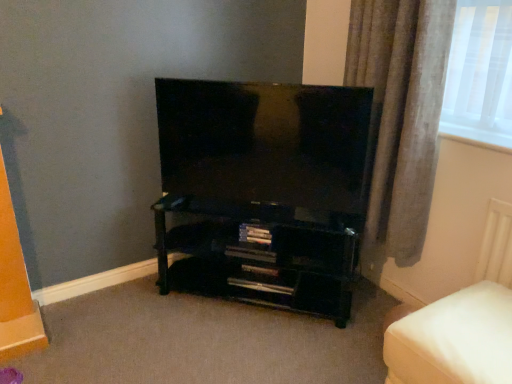
At what (x,y) coordinates should I click in order to perform the action: click on white fabric ottoman at lower right. Please return your answer as a coordinate pair (x, y). Looking at the image, I should click on (454, 339).

Find the location of a particular element. The height and width of the screenshot is (384, 512). black glossy tv at center is located at coordinates (266, 144).

The height and width of the screenshot is (384, 512). In order to click on white fabric ottoman at lower right in this screenshot , I will do pyautogui.click(x=454, y=339).

Is gray fabric curtain at right not inside white fabric ottoman at lower right?

Yes, gray fabric curtain at right is located beyond the bounds of white fabric ottoman at lower right.

Does gray fabric curtain at right have a lesser height compared to white fabric ottoman at lower right?

In fact, gray fabric curtain at right may be taller than white fabric ottoman at lower right.

Consider the image. Does gray fabric curtain at right turn towards white fabric ottoman at lower right?

No, gray fabric curtain at right is not turned towards white fabric ottoman at lower right.

How many degrees apart are the facing directions of black glossy tv at center and white fabric ottoman at lower right?

black glossy tv at center and white fabric ottoman at lower right are facing 42.9 degrees away from each other.

From the image's perspective, who appears lower, black glossy tv at center or white fabric ottoman at lower right?

white fabric ottoman at lower right is shown below in the image.

Is black glossy tv at center turned away from white fabric ottoman at lower right?

No.

In the scene shown: Looking at their sizes, would you say black glossy tv at center is wider or thinner than gray fabric curtain at right?

black glossy tv at center is thinner than gray fabric curtain at right.

In the scene shown: From the image's perspective, between black glossy tv at center and gray fabric curtain at right, which one is located above?

gray fabric curtain at right, from the image's perspective.

The width and height of the screenshot is (512, 384). I want to click on curtain located on the right of black glossy tv at center, so click(401, 112).

From a real-world perspective, is black glossy tv at center above or below gray fabric curtain at right?

Clearly, from a real-world perspective, black glossy tv at center is below gray fabric curtain at right.

In the image, is black glossy shelf at lower center positioned in front of or behind gray fabric curtain at right?

black glossy shelf at lower center is positioned farther from the viewer than gray fabric curtain at right.

Based on the photo, in terms of height, does black glossy shelf at lower center look taller or shorter compared to gray fabric curtain at right?

black glossy shelf at lower center is shorter than gray fabric curtain at right.

From the image's perspective, relative to gray fabric curtain at right, is black glossy shelf at lower center above or below?

Based on their image positions, black glossy shelf at lower center is located beneath gray fabric curtain at right.

Looking at this image, how distant is black glossy shelf at lower center from gray fabric curtain at right?

They are 22.58 inches apart.

Can you confirm if black glossy shelf at lower center is taller than black glossy tv at center?

In fact, black glossy shelf at lower center may be shorter than black glossy tv at center.

Is black glossy shelf at lower center completely or partially outside of black glossy tv at center?

Yes, black glossy shelf at lower center is not within black glossy tv at center.

Is black glossy shelf at lower center smaller than black glossy tv at center?

Actually, black glossy shelf at lower center might be larger than black glossy tv at center.

Is black glossy shelf at lower center oriented towards black glossy tv at center?

No.

From a real-world perspective, which is physically above, white fabric ottoman at lower right or black glossy shelf at lower center?

In real-world perspective, black glossy shelf at lower center is above.

Can you tell me how much white fabric ottoman at lower right and black glossy shelf at lower center differ in facing direction?

43 degrees separate the facing orientations of white fabric ottoman at lower right and black glossy shelf at lower center.

Between white fabric ottoman at lower right and black glossy shelf at lower center, which one has smaller size?

white fabric ottoman at lower right is smaller.

Is white fabric ottoman at lower right taller than black glossy shelf at lower center?

No, white fabric ottoman at lower right is not taller than black glossy shelf at lower center.

Is the surface of gray fabric curtain at right in direct contact with black glossy shelf at lower center?

No, gray fabric curtain at right is not making contact with black glossy shelf at lower center.

From a real-world perspective, is gray fabric curtain at right physically located above or below black glossy shelf at lower center?

From a real-world perspective, gray fabric curtain at right is physically above black glossy shelf at lower center.

Which of these two, gray fabric curtain at right or black glossy shelf at lower center, stands shorter?

Standing shorter between the two is black glossy shelf at lower center.

From the image's perspective, is gray fabric curtain at right above black glossy shelf at lower center?

Correct, gray fabric curtain at right appears higher than black glossy shelf at lower center in the image.

Where is `curtain above the white fabric ottoman at lower right (from a real-world perspective)`? This screenshot has height=384, width=512. curtain above the white fabric ottoman at lower right (from a real-world perspective) is located at coordinates (401, 112).

The width and height of the screenshot is (512, 384). Identify the location of television that appears behind the white fabric ottoman at lower right. (266, 144).

Based on their spatial positions, is white fabric ottoman at lower right or black glossy tv at center closer to black glossy shelf at lower center?

black glossy tv at center lies closer to black glossy shelf at lower center than the other object.

Based on their spatial positions, is white fabric ottoman at lower right or black glossy tv at center further from gray fabric curtain at right?

white fabric ottoman at lower right.

Consider the image. Looking at the image, which one is located closer to white fabric ottoman at lower right, gray fabric curtain at right or black glossy tv at center?

gray fabric curtain at right is closer to white fabric ottoman at lower right.

Looking at the image, which one is located closer to black glossy tv at center, white fabric ottoman at lower right or black glossy shelf at lower center?

Among the two, black glossy shelf at lower center is located nearer to black glossy tv at center.

Looking at the image, which one is located further to gray fabric curtain at right, black glossy shelf at lower center or white fabric ottoman at lower right?

white fabric ottoman at lower right is positioned further to the anchor gray fabric curtain at right.

Based on the photo, from the image, which object appears to be nearer to black glossy shelf at lower center, black glossy tv at center or gray fabric curtain at right?

black glossy tv at center.

Based on their spatial positions, is black glossy tv at center or gray fabric curtain at right further from white fabric ottoman at lower right?

Based on the image, black glossy tv at center appears to be further to white fabric ottoman at lower right.

When comparing their distances from black glossy tv at center, does gray fabric curtain at right or white fabric ottoman at lower right seem closer?

gray fabric curtain at right lies closer to black glossy tv at center than the other object.

This screenshot has width=512, height=384. I want to click on television between gray fabric curtain at right and white fabric ottoman at lower right vertically, so click(266, 144).

This screenshot has width=512, height=384. I want to click on television between black glossy shelf at lower center and white fabric ottoman at lower right, so [266, 144].

This screenshot has width=512, height=384. What are the coordinates of `shelf between gray fabric curtain at right and white fabric ottoman at lower right from top to bottom` in the screenshot? It's located at (259, 256).

Locate an element on the screen. The width and height of the screenshot is (512, 384). television between black glossy shelf at lower center and gray fabric curtain at right from left to right is located at coordinates (266, 144).